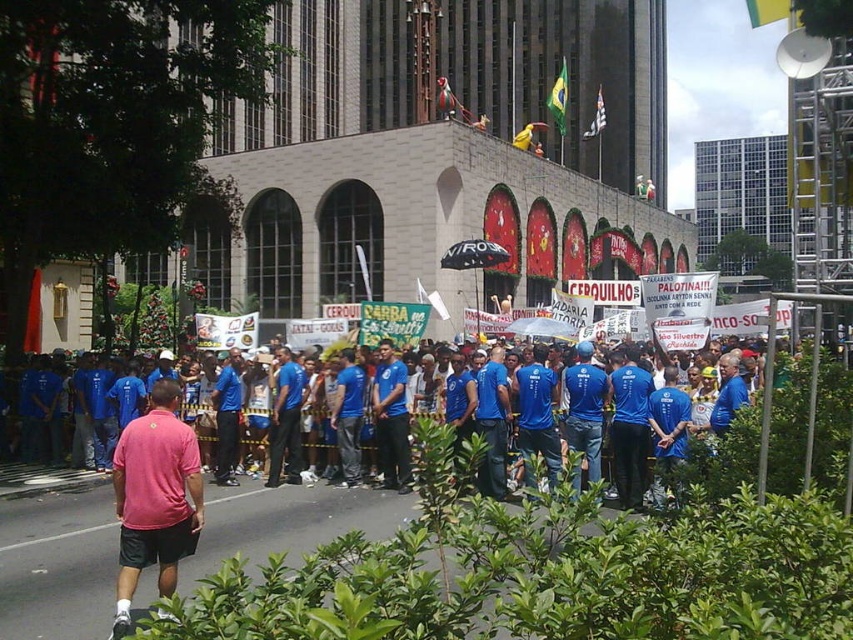
You are a photographer trying to capture a clear shot of both the pink cotton polo shirt at center and the blue fabric shirt at center in the crowd. Given their sizes, which one should you focus on first to ensure it fits within your camera frame?

The pink cotton polo shirt at center is larger in size than the blue fabric shirt at center, so you should focus on capturing the pink cotton polo shirt at center first to ensure it fits within the camera frame before adjusting for the smaller blue fabric shirt at center.

You are a photographer trying to capture a photo of the blue fabric shirt at center without the pink cotton polo shirt at center blocking it. What should you do?

Move your position to the side so that the blue fabric shirt at center is no longer behind the pink cotton polo shirt at center. Since the pink cotton polo shirt at center is in front of the blue fabric shirt at center, adjusting your angle or moving around could allow you to see the blue fabric shirt at center without obstruction.